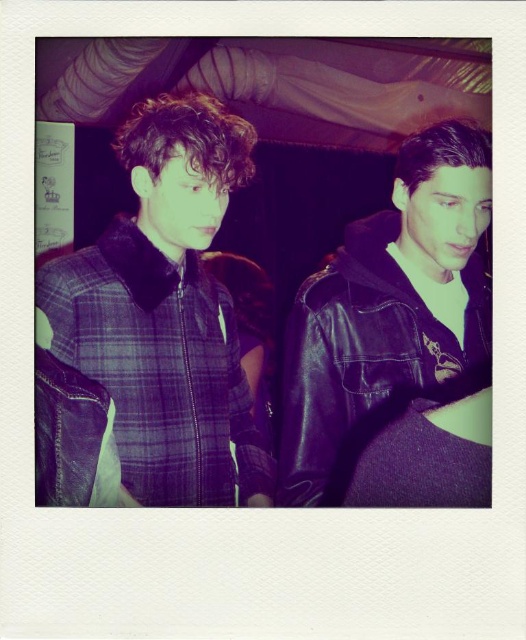
Between point (234, 326) and point (345, 472), which one is positioned behind?

The point (234, 326) is more distant.

Does plaid fabric jacket at left appear under black leather jacket at right?

Incorrect, plaid fabric jacket at left is not positioned below black leather jacket at right.

You are a GUI agent. You are given a task and a screenshot of the screen. Output one action in this format:
    pyautogui.click(x=<x>, y=<y>)
    Task: Click on the plaid fabric jacket at left
    The width and height of the screenshot is (526, 640).
    Given the screenshot: What is the action you would take?
    pyautogui.click(x=166, y=310)